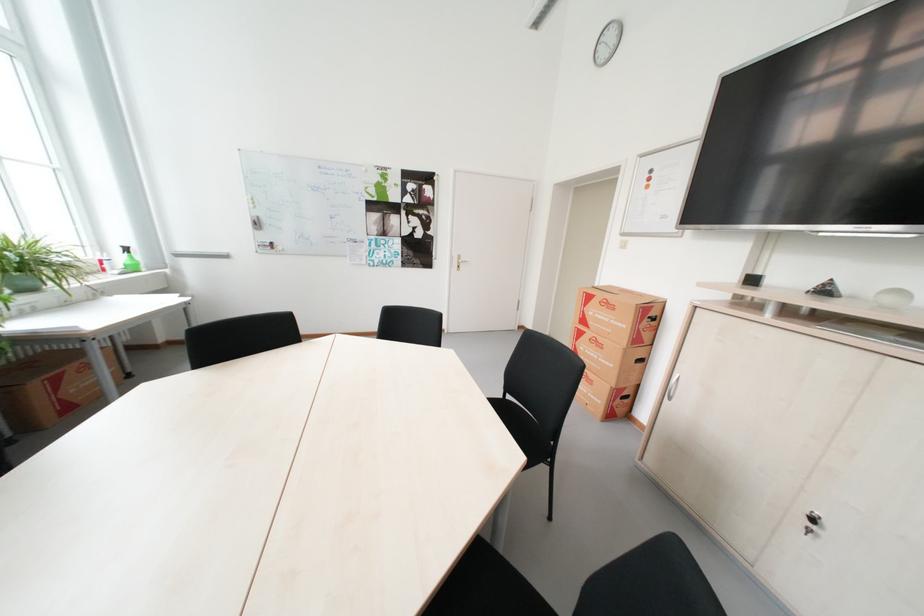
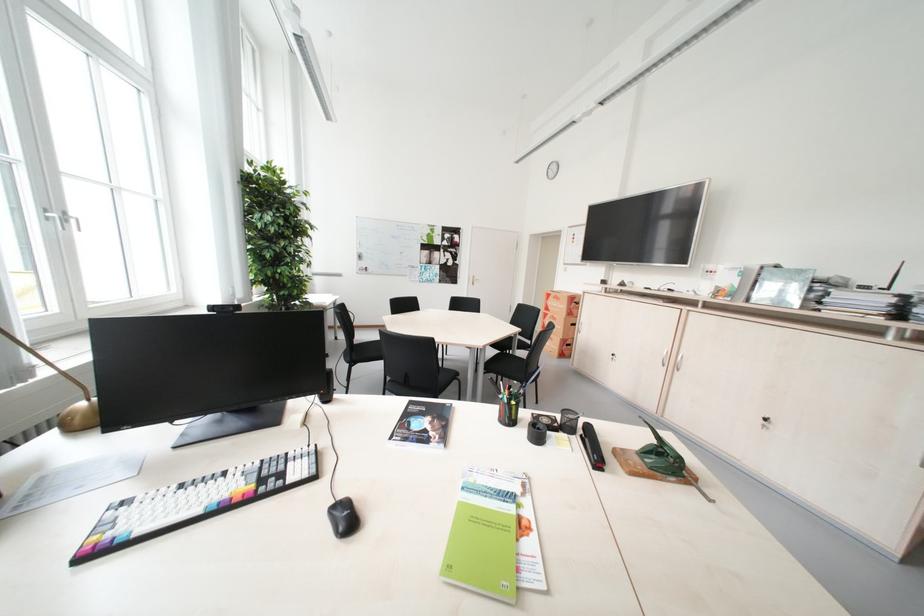
Question: In a continuous first-person perspective shot, in which direction is the camera moving?

Choices:
 (A) Left
 (B) Right
 (C) Forward
 (D) Backward

Answer: (D)